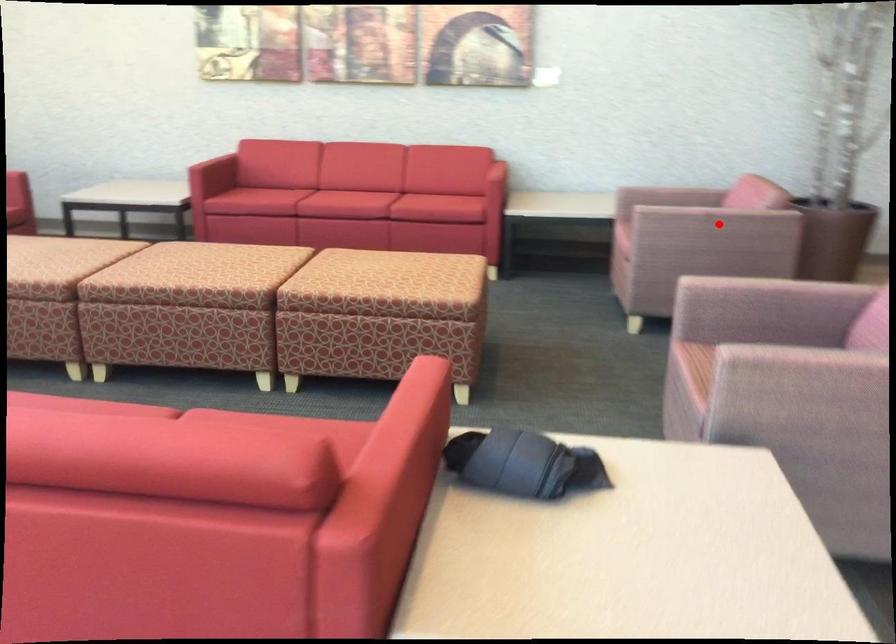
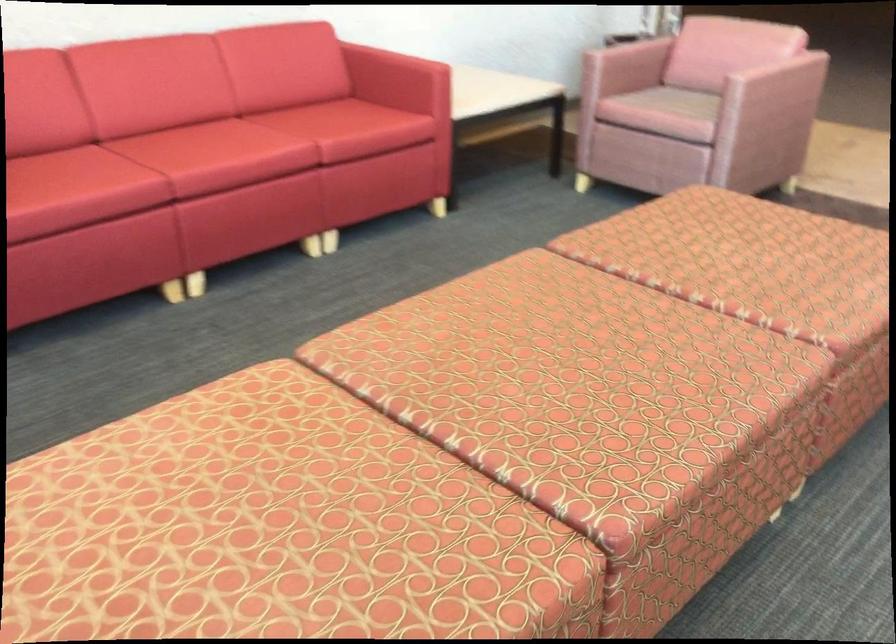
Find the pixel in the second image that matches the highlighted location in the first image.

(773, 90)